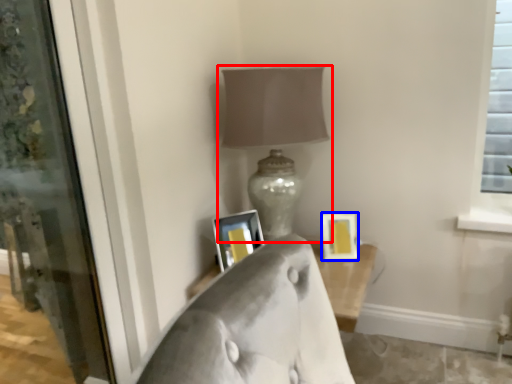
Question: Which of the following is the closest to the observer, lamp (highlighted by a red box) or picture frame (highlighted by a blue box)?

Choices:
 (A) lamp
 (B) picture frame

Answer: (A)